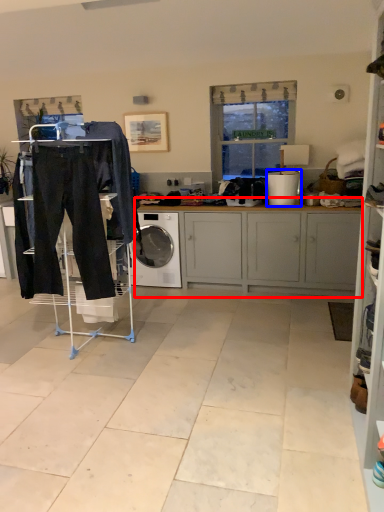
Question: Which point is further to the camera, cabinetry (highlighted by a red box) or appliance (highlighted by a blue box)?

Choices:
 (A) cabinetry
 (B) appliance

Answer: (B)